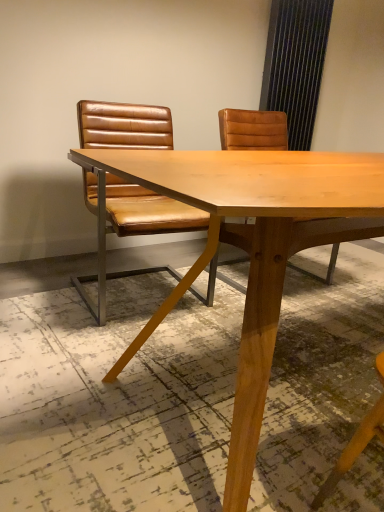
Question: Is light brown wood table at center to the left or to the right of brown leather chair at left in the image?

Choices:
 (A) right
 (B) left

Answer: (A)

Question: Looking at the image, does light brown wood table at center seem bigger or smaller compared to brown leather chair at left?

Choices:
 (A) big
 (B) small

Answer: (A)

Question: From a real-world perspective, is light brown wood table at center physically located above or below brown leather chair at left?

Choices:
 (A) above
 (B) below

Answer: (B)

Question: From the image's perspective, is brown leather chair at left located above or below light brown wood table at center?

Choices:
 (A) below
 (B) above

Answer: (B)

Question: Is point (152, 132) positioned closer to the camera than point (263, 177)?

Choices:
 (A) closer
 (B) farther

Answer: (B)

Question: Considering their positions, is brown leather chair at left located in front of or behind light brown wood table at center?

Choices:
 (A) behind
 (B) front

Answer: (A)

Question: In the image, is brown leather chair at left on the left side or the right side of light brown wood table at center?

Choices:
 (A) right
 (B) left

Answer: (B)